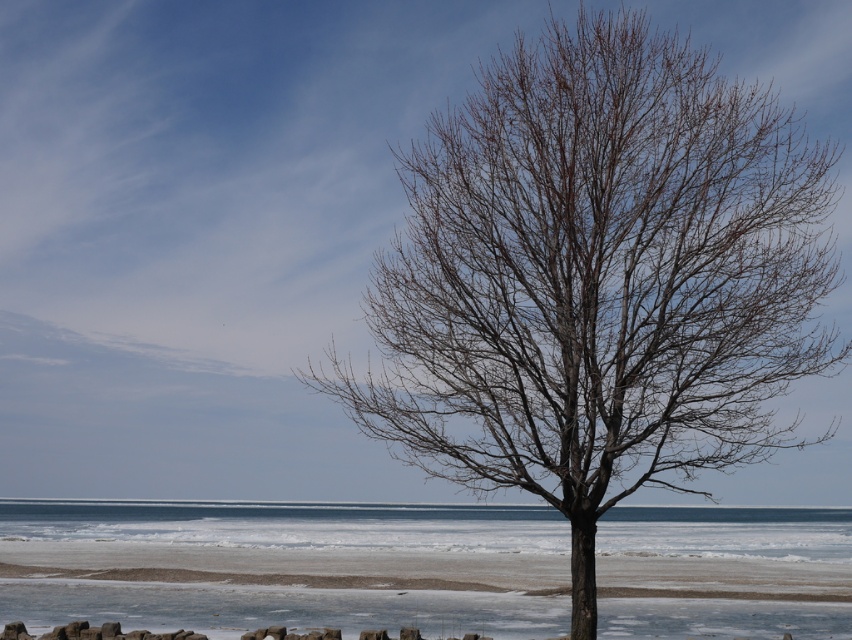
Question: Does bare branches at center appear under frozen ice at lower center?

Choices:
 (A) no
 (B) yes

Answer: (A)

Question: Can you confirm if bare branches at center is positioned above frozen ice at lower center?

Choices:
 (A) yes
 (B) no

Answer: (A)

Question: Does bare branches at center appear on the left side of frozen ice at lower center?

Choices:
 (A) yes
 (B) no

Answer: (B)

Question: Which object appears farthest from the camera in this image?

Choices:
 (A) frozen ice at lower center
 (B) bare branches at center

Answer: (A)